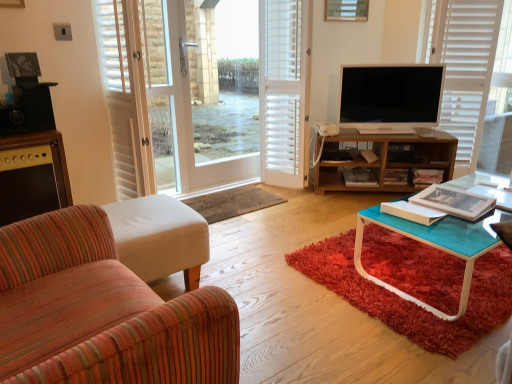
Image resolution: width=512 pixels, height=384 pixels. I want to click on vacant space to the left of shaggy red rug at lower right, so click(267, 268).